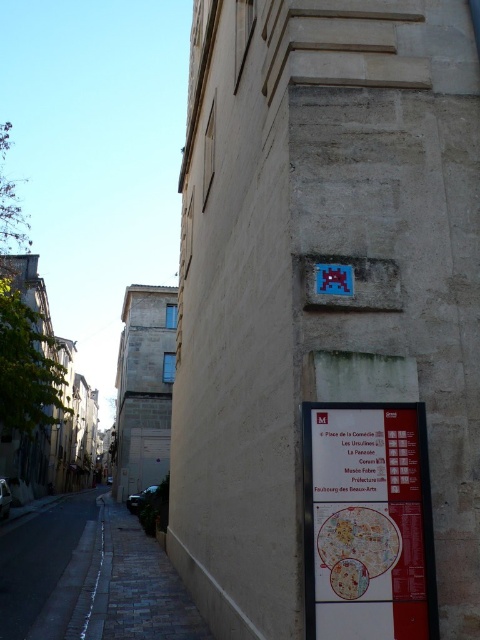
Question: Does white paper map at lower right have a smaller size compared to dark asphalt road at lower left?

Choices:
 (A) yes
 (B) no

Answer: (A)

Question: Which point is closer to the camera?

Choices:
 (A) dark asphalt road at lower left
 (B) white paper map at lower right

Answer: (B)

Question: Is white paper map at lower right wider than dark asphalt road at lower left?

Choices:
 (A) yes
 (B) no

Answer: (B)

Question: Which object appears farthest from the camera in this image?

Choices:
 (A) dark asphalt road at lower left
 (B) white paper map at lower right

Answer: (A)

Question: Is white paper map at lower right thinner than dark asphalt road at lower left?

Choices:
 (A) no
 (B) yes

Answer: (B)